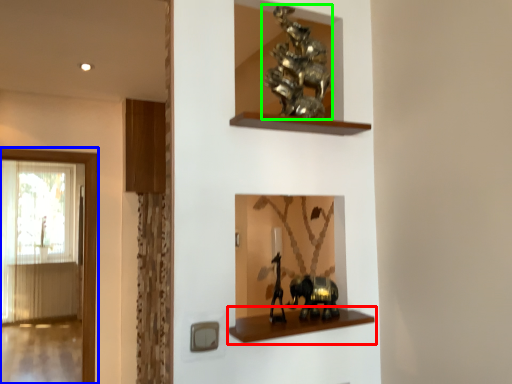
Question: Considering the real-world distances, which object is closest to shelf (highlighted by a red box)? window (highlighted by a blue box) or animal (highlighted by a green box).

Choices:
 (A) window
 (B) animal

Answer: (B)